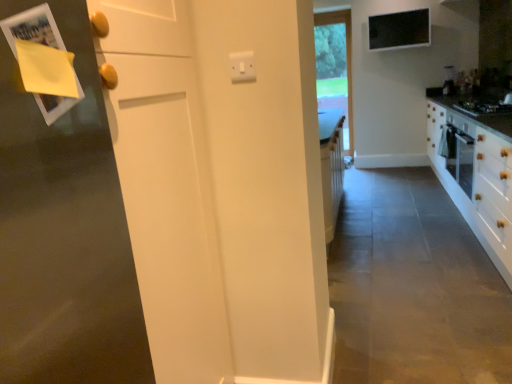
Question: Is black glass gas stove at right to the left or to the right of clear glass window at center in the image?

Choices:
 (A) left
 (B) right

Answer: (B)

Question: Considering the positions of black glass gas stove at right and clear glass window at center in the image, is black glass gas stove at right taller or shorter than clear glass window at center?

Choices:
 (A) tall
 (B) short

Answer: (B)

Question: From the image's perspective, is black glass gas stove at right above or below clear glass window at center?

Choices:
 (A) above
 (B) below

Answer: (B)

Question: In terms of width, does clear glass window at center look wider or thinner when compared to black glass gas stove at right?

Choices:
 (A) thin
 (B) wide

Answer: (A)

Question: From the image's perspective, is clear glass window at center located above or below black glass gas stove at right?

Choices:
 (A) above
 (B) below

Answer: (A)

Question: Is clear glass window at center spatially inside black glass gas stove at right, or outside of it?

Choices:
 (A) outside
 (B) inside

Answer: (A)

Question: Considering the positions of point (350, 125) and point (474, 109), is point (350, 125) closer or farther from the camera than point (474, 109)?

Choices:
 (A) closer
 (B) farther

Answer: (B)